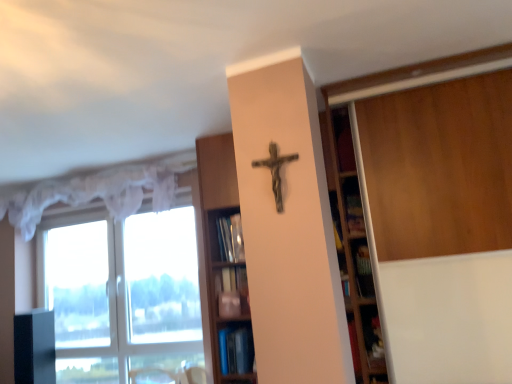
What do you see at coordinates (96, 192) in the screenshot? I see `white sheer curtain at upper left` at bounding box center [96, 192].

Where is `blue glossy bookshelf at lower center, placed as the 1th shelf when sorted from bottom to top`? blue glossy bookshelf at lower center, placed as the 1th shelf when sorted from bottom to top is located at coordinates (236, 349).

Find the location of a particular element. The width and height of the screenshot is (512, 384). rusty metal crucifix at center is located at coordinates (275, 171).

Find the location of a particular element. This screenshot has height=384, width=512. white sheer curtain at upper left is located at coordinates (96, 192).

From the image's perspective, relative to blue glossy bookshelf at lower center, placed as the 1th shelf when sorted from bottom to top, is white sheer curtain at upper left above or below?

Clearly, from the image's perspective, white sheer curtain at upper left is above blue glossy bookshelf at lower center, placed as the 1th shelf when sorted from bottom to top.

Is white sheer curtain at upper left facing away from blue glossy bookshelf at lower center, placed as the second shelf when sorted from top to bottom?

No, white sheer curtain at upper left is not facing the opposite direction of blue glossy bookshelf at lower center, placed as the second shelf when sorted from top to bottom.

Which point is more distant from viewer, (157, 205) or (236, 332)?

Positioned behind is point (157, 205).

Which is in front, white sheer curtain at upper left or blue glossy bookshelf at lower center, placed as the 1th shelf when sorted from bottom to top?

blue glossy bookshelf at lower center, placed as the 1th shelf when sorted from bottom to top.

Consider the image. Is wooden bookshelf at center, arranged as the first shelf when viewed from the top, taller than blue glossy bookshelf at lower center, placed as the 1th shelf when sorted from bottom to top?

Correct, wooden bookshelf at center, arranged as the first shelf when viewed from the top, is much taller as blue glossy bookshelf at lower center, placed as the 1th shelf when sorted from bottom to top.

Is wooden bookshelf at center, arranged as the first shelf when viewed from the top, facing away from blue glossy bookshelf at lower center, placed as the second shelf when sorted from top to bottom?

Yes.

How many degrees apart are the facing directions of wooden bookshelf at center, the second shelf from the bottom, and blue glossy bookshelf at lower center, placed as the 1th shelf when sorted from bottom to top?

There is a 0.219-degree angle between the facing directions of wooden bookshelf at center, the second shelf from the bottom, and blue glossy bookshelf at lower center, placed as the 1th shelf when sorted from bottom to top.

Between point (209, 203) and point (225, 336), which one is positioned behind?

Point (209, 203)

From a real-world perspective, relative to black glossy cabinet at left, is transparent glass window at left vertically above or below?

Clearly, from a real-world perspective, transparent glass window at left is above black glossy cabinet at left.

Is transparent glass window at left bigger than black glossy cabinet at left?

Correct, transparent glass window at left is larger in size than black glossy cabinet at left.

The height and width of the screenshot is (384, 512). Identify the location of window in front of the black glossy cabinet at left. (122, 283).

Is point (162, 301) positioned behind point (216, 232)?

Yes, point (162, 301) is farther from viewer.

From the picture: Does transparent glass window at left turn towards wooden bookshelf at center, arranged as the first shelf when viewed from the top?

No, transparent glass window at left is not oriented towards wooden bookshelf at center, arranged as the first shelf when viewed from the top.

Which object is more forward, transparent glass window at left or wooden bookshelf at center, arranged as the first shelf when viewed from the top?

wooden bookshelf at center, arranged as the first shelf when viewed from the top, is in front.

Looking at their sizes, would you say transparent glass window at left is wider or thinner than wooden bookshelf at center, arranged as the first shelf when viewed from the top?

transparent glass window at left is thinner than wooden bookshelf at center, arranged as the first shelf when viewed from the top.

Based on the photo, from the image's perspective, is blue glossy bookshelf at lower center, placed as the second shelf when sorted from top to bottom, on top of black glossy cabinet at left?

Indeed, from the image's perspective, blue glossy bookshelf at lower center, placed as the second shelf when sorted from top to bottom, is shown above black glossy cabinet at left.

Is black glossy cabinet at left at the back of blue glossy bookshelf at lower center, placed as the second shelf when sorted from top to bottom?

blue glossy bookshelf at lower center, placed as the second shelf when sorted from top to bottom, is not turned away from black glossy cabinet at left.

Is the position of blue glossy bookshelf at lower center, placed as the 1th shelf when sorted from bottom to top, more distant than that of black glossy cabinet at left?

No.

From a real-world perspective, is blue glossy bookshelf at lower center, placed as the second shelf when sorted from top to bottom, positioned under black glossy cabinet at left based on gravity?

No, from a real-world perspective, blue glossy bookshelf at lower center, placed as the second shelf when sorted from top to bottom, is not under black glossy cabinet at left.

Which is more to the right, transparent glass window at left or blue glossy bookshelf at lower center, placed as the second shelf when sorted from top to bottom?

blue glossy bookshelf at lower center, placed as the second shelf when sorted from top to bottom, is more to the right.

Considering the positions of point (89, 263) and point (233, 346), is point (89, 263) closer or farther from the camera than point (233, 346)?

Point (89, 263).

Considering the sizes of objects transparent glass window at left and blue glossy bookshelf at lower center, placed as the second shelf when sorted from top to bottom, in the image provided, who is shorter, transparent glass window at left or blue glossy bookshelf at lower center, placed as the second shelf when sorted from top to bottom,?

Standing shorter between the two is blue glossy bookshelf at lower center, placed as the second shelf when sorted from top to bottom.

Which object is further away from the camera taking this photo, transparent glass window at left or blue glossy bookshelf at lower center, placed as the second shelf when sorted from top to bottom?

transparent glass window at left is behind.

You are a GUI agent. You are given a task and a screenshot of the screen. Output one action in this format:
    pyautogui.click(x=<x>, y=<y>)
    Task: Click on the curtain that appears in front of the transparent glass window at left
    
    Given the screenshot: What is the action you would take?
    pyautogui.click(x=96, y=192)

From a real-world perspective, between white sheer curtain at upper left and transparent glass window at left, who is vertically lower?

transparent glass window at left.

Does white sheer curtain at upper left have a smaller size compared to transparent glass window at left?

Yes.

Is the position of white sheer curtain at upper left more distant than that of transparent glass window at left?

No.

Where is `curtain on the left side of blue glossy bookshelf at lower center, placed as the second shelf when sorted from top to bottom`? curtain on the left side of blue glossy bookshelf at lower center, placed as the second shelf when sorted from top to bottom is located at coordinates (96, 192).

Where is `shelf below the wooden bookshelf at center, the second shelf from the bottom (from the image's perspective)`? shelf below the wooden bookshelf at center, the second shelf from the bottom (from the image's perspective) is located at coordinates (236, 349).

In the scene shown: Considering their positions, is black glossy cabinet at left positioned closer to wooden bookshelf at center, arranged as the first shelf when viewed from the top, than rusty metal crucifix at center?

rusty metal crucifix at center.

Based on the photo, looking at the image, which one is located further to black glossy cabinet at left, white sheer curtain at upper left or wooden bookshelf at center, the second shelf from the bottom?

Among the two, wooden bookshelf at center, the second shelf from the bottom, is located further to black glossy cabinet at left.

From the image, which object appears to be farther from blue glossy bookshelf at lower center, placed as the second shelf when sorted from top to bottom, transparent glass window at left or rusty metal crucifix at center?

rusty metal crucifix at center.

Based on their spatial positions, is blue glossy bookshelf at lower center, placed as the 1th shelf when sorted from bottom to top, or transparent glass window at left closer to rusty metal crucifix at center?

blue glossy bookshelf at lower center, placed as the 1th shelf when sorted from bottom to top.

From the image, which object appears to be nearer to transparent glass window at left, rusty metal crucifix at center or white sheer curtain at upper left?

white sheer curtain at upper left is positioned closer to the anchor transparent glass window at left.

Which object lies nearer to the anchor point wooden bookshelf at center, arranged as the first shelf when viewed from the top, rusty metal crucifix at center or blue glossy bookshelf at lower center, placed as the second shelf when sorted from top to bottom?

The object closer to wooden bookshelf at center, arranged as the first shelf when viewed from the top, is blue glossy bookshelf at lower center, placed as the second shelf when sorted from top to bottom.

Which object lies nearer to the anchor point white sheer curtain at upper left, black glossy cabinet at left or blue glossy bookshelf at lower center, placed as the second shelf when sorted from top to bottom?

black glossy cabinet at left lies closer to white sheer curtain at upper left than the other object.

Which object lies nearer to the anchor point blue glossy bookshelf at lower center, placed as the 1th shelf when sorted from bottom to top, wooden bookshelf at center, arranged as the first shelf when viewed from the top, or white sheer curtain at upper left?

Among the two, wooden bookshelf at center, arranged as the first shelf when viewed from the top, is located nearer to blue glossy bookshelf at lower center, placed as the 1th shelf when sorted from bottom to top.

This screenshot has width=512, height=384. In order to click on window located between black glossy cabinet at left and wooden bookshelf at center, the second shelf from the bottom, in the left-right direction in this screenshot , I will do `click(122, 283)`.

At what (x,y) coordinates should I click in order to perform the action: click on curtain between rusty metal crucifix at center and transparent glass window at left in the front-back direction. Please return your answer as a coordinate pair (x, y). The image size is (512, 384). Looking at the image, I should click on (96, 192).

Identify the location of window between black glossy cabinet at left and rusty metal crucifix at center from left to right. pos(122,283).

Image resolution: width=512 pixels, height=384 pixels. Identify the location of curtain situated between black glossy cabinet at left and rusty metal crucifix at center from left to right. (96, 192).